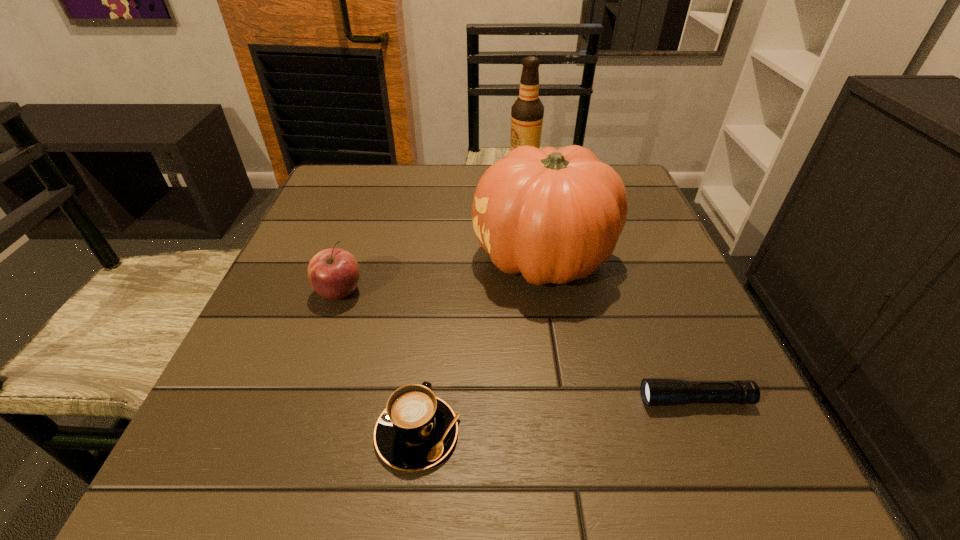
Locate an element on the screen. vacant space that satisfies the following two spatial constraints: 1. on the label of the alcohol; 2. on the front side of the third tallest object is located at coordinates (540, 292).

The width and height of the screenshot is (960, 540). Identify the location of free space that satisfies the following two spatial constraints: 1. on the label of the farthest object; 2. on the front side of the cappuccino. (562, 433).

This screenshot has width=960, height=540. I want to click on free space that satisfies the following two spatial constraints: 1. at the lens end of the flashlight; 2. on the front side of the cappuccino, so click(708, 433).

Find the location of a particular element. vacant area that satisfies the following two spatial constraints: 1. on the carved face of the fourth shortest object; 2. on the front side of the apple is located at coordinates (x=549, y=292).